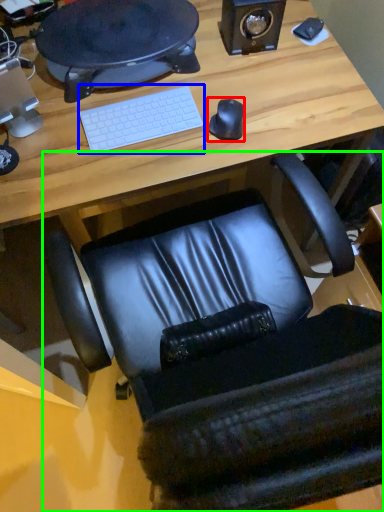
Question: Estimate the real-world distances between objects in this image. Which object is farther from mouse (highlighted by a red box), computer keyboard (highlighted by a blue box) or chair (highlighted by a green box)?

Choices:
 (A) computer keyboard
 (B) chair

Answer: (B)